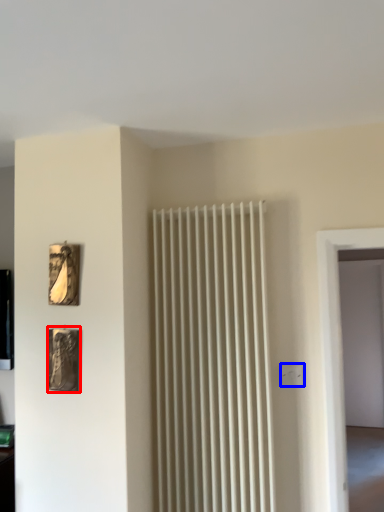
Question: Which object appears closest to the camera in this image, picture frame (highlighted by a red box) or electric outlet (highlighted by a blue box)?

Choices:
 (A) picture frame
 (B) electric outlet

Answer: (A)